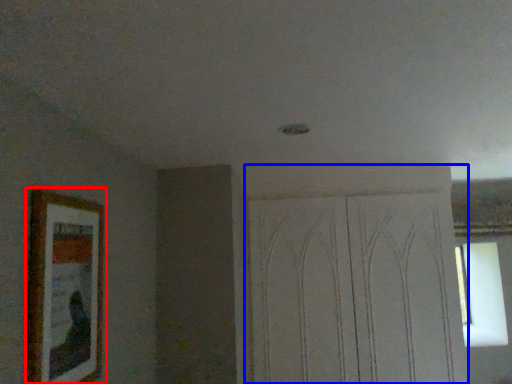
Question: Which object is further to the camera taking this photo, picture frame (highlighted by a red box) or screen door (highlighted by a blue box)?

Choices:
 (A) picture frame
 (B) screen door

Answer: (B)